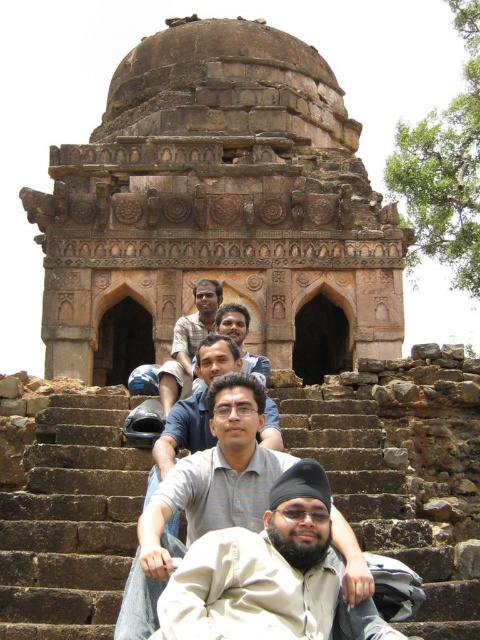
Question: Is brown stone ruins at center wider than light brown skin at center?

Choices:
 (A) no
 (B) yes

Answer: (B)

Question: Which point is farther from the camera taking this photo?

Choices:
 (A) (213, 52)
 (B) (193, 339)
 (C) (242, 385)

Answer: (A)

Question: Does gray striped shirt at center lie in front of light brown skin at center?

Choices:
 (A) yes
 (B) no

Answer: (A)

Question: Which point is closer to the camera taking this photo?

Choices:
 (A) (280, 472)
 (B) (202, 296)
 (C) (290, 198)

Answer: (A)

Question: Which object appears closest to the camera in this image?

Choices:
 (A) gray striped shirt at center
 (B) light brown skin at center
 (C) brown stone ruins at center

Answer: (A)

Question: From the image, what is the correct spatial relationship of brown stone ruins at center in relation to gray striped shirt at center?

Choices:
 (A) below
 (B) above

Answer: (B)